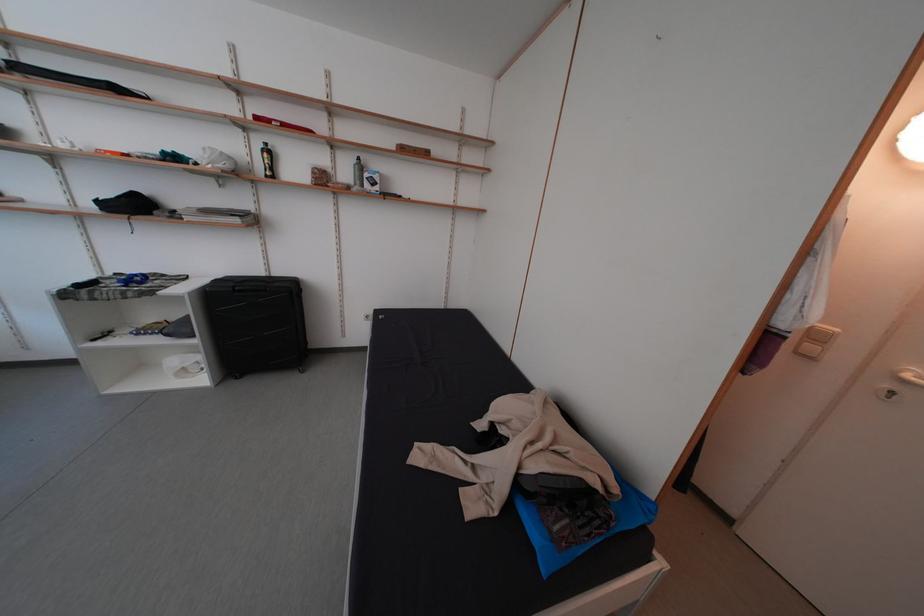
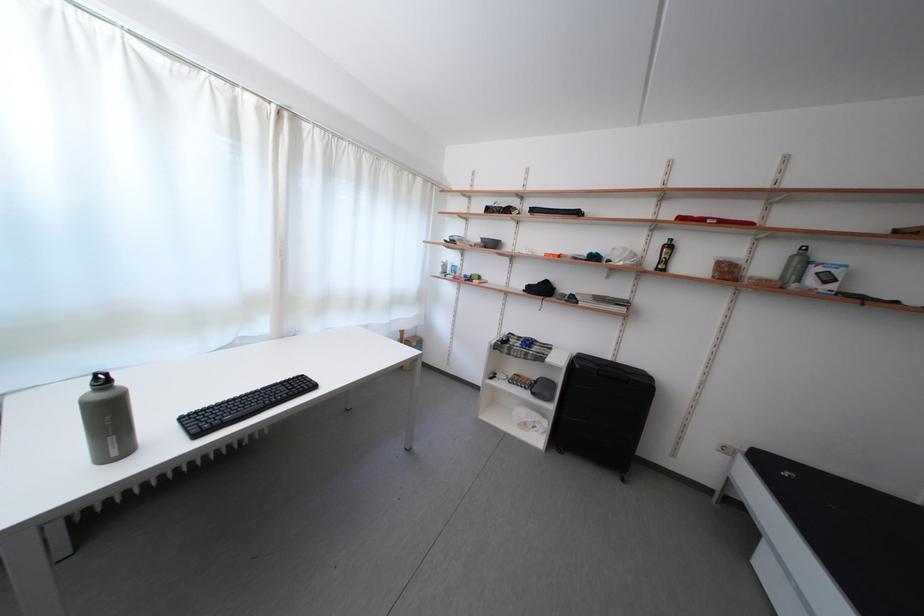
The point at (272, 280) is marked in the first image. Where is the corresponding point in the second image?

(617, 363)